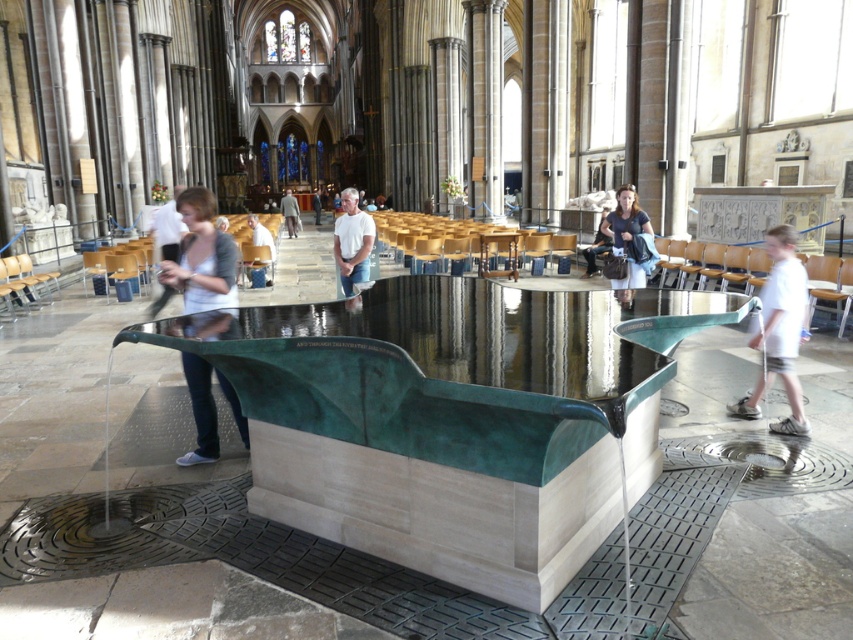
Question: Which object is positioned farthest from the dark blue jeans at center?

Choices:
 (A) white cotton shirt at center
 (B) white shirt at center
 (C) denim jacket at upper center

Answer: (A)

Question: Which object is the farthest from the matte white shirt at center?

Choices:
 (A) matte black jacket at left
 (B) dark blue jeans at center
 (C) light brown leather jacket at center

Answer: (C)

Question: Can you confirm if denim jacket at upper center is positioned below light brown leather jacket at center?

Choices:
 (A) no
 (B) yes

Answer: (B)

Question: Which point is farther from the camera taking this photo?

Choices:
 (A) (339, 232)
 (B) (614, 243)

Answer: (B)

Question: Where is matte black jacket at left located in relation to white shirt at center in the image?

Choices:
 (A) below
 (B) above

Answer: (A)

Question: Can you confirm if matte black jacket at left is smaller than white shirt at center?

Choices:
 (A) yes
 (B) no

Answer: (A)